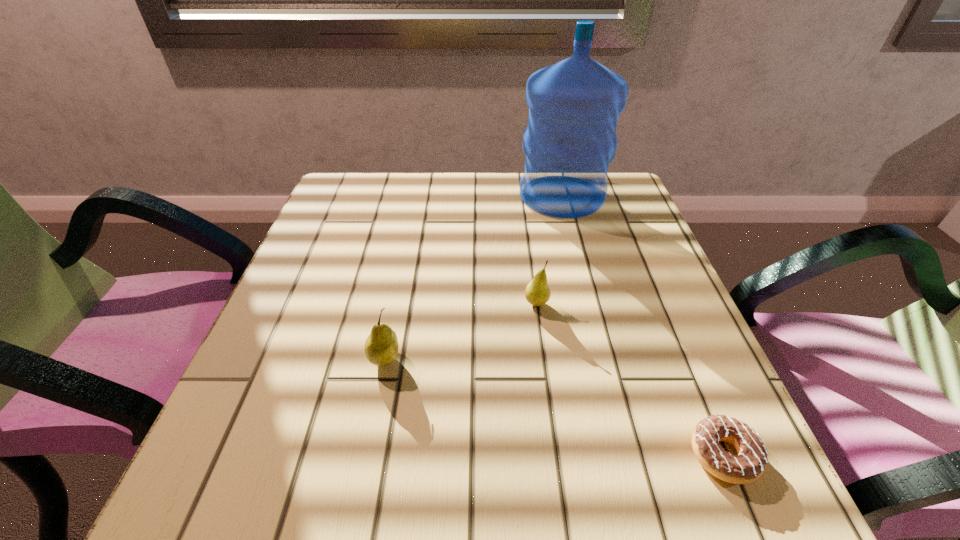
This screenshot has height=540, width=960. I want to click on vacant space at the right edge, so click(x=643, y=331).

This screenshot has width=960, height=540. I want to click on vacant space at the far left corner, so click(x=379, y=203).

In the image, there is a desktop. In order to click on vacant space at the far right corner in this screenshot , I will do `click(603, 217)`.

The width and height of the screenshot is (960, 540). What are the coordinates of `vacant region between the farther pear and the nearest object` in the screenshot? It's located at (630, 379).

Where is `vacant area that lies between the tallest object and the leftmost object`? The image size is (960, 540). vacant area that lies between the tallest object and the leftmost object is located at coordinates (473, 277).

Image resolution: width=960 pixels, height=540 pixels. In order to click on free space between the farther pear and the nearer pear in this screenshot , I will do `click(461, 331)`.

Where is `vacant space in between the tallest object and the leftmost object`? Image resolution: width=960 pixels, height=540 pixels. vacant space in between the tallest object and the leftmost object is located at coordinates (473, 277).

At what (x,y) coordinates should I click in order to perform the action: click on vacant region between the leftmost object and the shortest object. Please return your answer as a coordinate pair (x, y). Looking at the image, I should click on (554, 407).

The image size is (960, 540). I want to click on vacant area between the farther pear and the nearest object, so click(630, 379).

This screenshot has width=960, height=540. What are the coordinates of `free space between the water jug and the shortest object` in the screenshot? It's located at (642, 325).